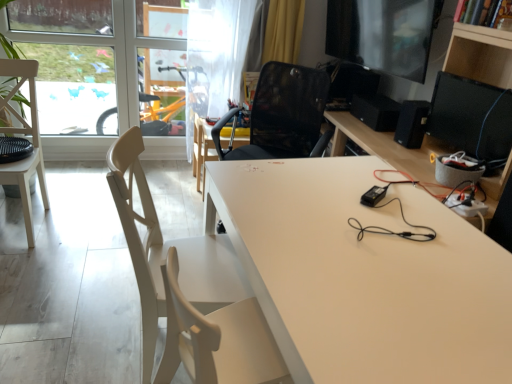
Question: Would you consider matte black monitor at upper right, acting as the first computer monitor starting from the top, to be distant from black matte speaker at upper right, which is the first speaker in back-to-front order?

Choices:
 (A) yes
 (B) no

Answer: (B)

Question: Considering the relative sizes of matte black monitor at upper right, the second computer monitor positioned from the bottom, and black matte speaker at upper right, the second speaker in the front-to-back sequence, in the image provided, is matte black monitor at upper right, the second computer monitor positioned from the bottom, smaller than black matte speaker at upper right, the second speaker in the front-to-back sequence,?

Choices:
 (A) no
 (B) yes

Answer: (A)

Question: From a real-world perspective, is matte black monitor at upper right, acting as the first computer monitor starting from the top, physically above black matte speaker at upper right, the second speaker in the front-to-back sequence?

Choices:
 (A) yes
 (B) no

Answer: (A)

Question: Can you confirm if matte black monitor at upper right, the second computer monitor positioned from the bottom, is shorter than black matte speaker at upper right, the second speaker in the front-to-back sequence?

Choices:
 (A) no
 (B) yes

Answer: (A)

Question: From the image's perspective, is matte black monitor at upper right, the second computer monitor positioned from the bottom, below black matte speaker at upper right, the second speaker in the front-to-back sequence?

Choices:
 (A) no
 (B) yes

Answer: (A)

Question: Does matte black monitor at upper right, acting as the first computer monitor starting from the top, have a larger size compared to black matte speaker at upper right, the second speaker in the front-to-back sequence?

Choices:
 (A) yes
 (B) no

Answer: (A)

Question: Is transparent glass window at upper left smaller than matte black monitor at upper right, acting as the first computer monitor starting from the top?

Choices:
 (A) no
 (B) yes

Answer: (A)

Question: Is transparent glass window at upper left in contact with matte black monitor at upper right, the second computer monitor positioned from the bottom?

Choices:
 (A) no
 (B) yes

Answer: (A)

Question: From the image's perspective, is transparent glass window at upper left located beneath matte black monitor at upper right, acting as the first computer monitor starting from the top?

Choices:
 (A) yes
 (B) no

Answer: (A)

Question: Is transparent glass window at upper left at the left side of matte black monitor at upper right, acting as the first computer monitor starting from the top?

Choices:
 (A) no
 (B) yes

Answer: (B)

Question: Is matte black monitor at upper right, acting as the first computer monitor starting from the top, a part of transparent glass window at upper left?

Choices:
 (A) yes
 (B) no

Answer: (B)

Question: Is transparent glass window at upper left closer to camera compared to matte black monitor at upper right, the second computer monitor positioned from the bottom?

Choices:
 (A) no
 (B) yes

Answer: (A)

Question: Can you confirm if white wood chair at left, acting as the second chair starting from the back, is taller than white matte table at center, the second table when ordered from top to bottom?

Choices:
 (A) yes
 (B) no

Answer: (A)